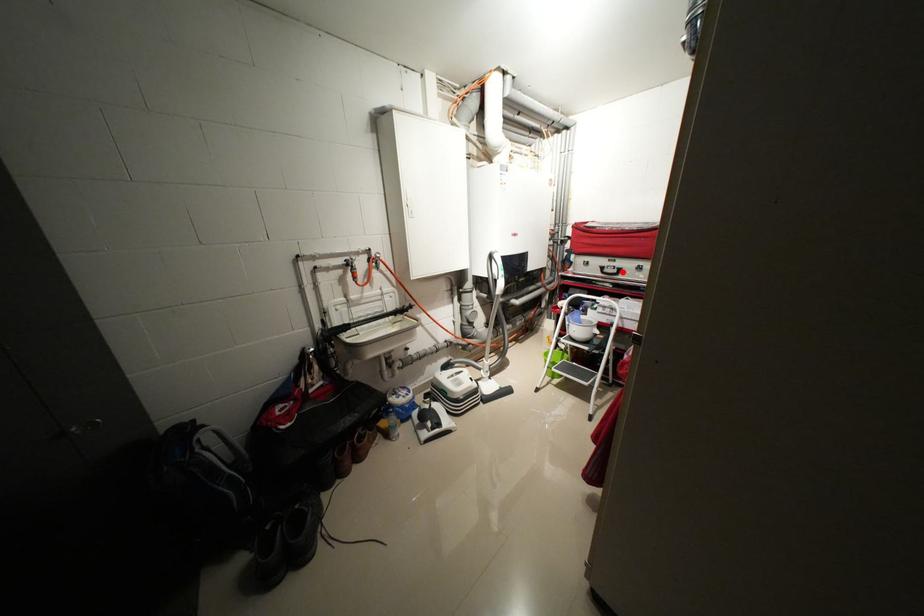
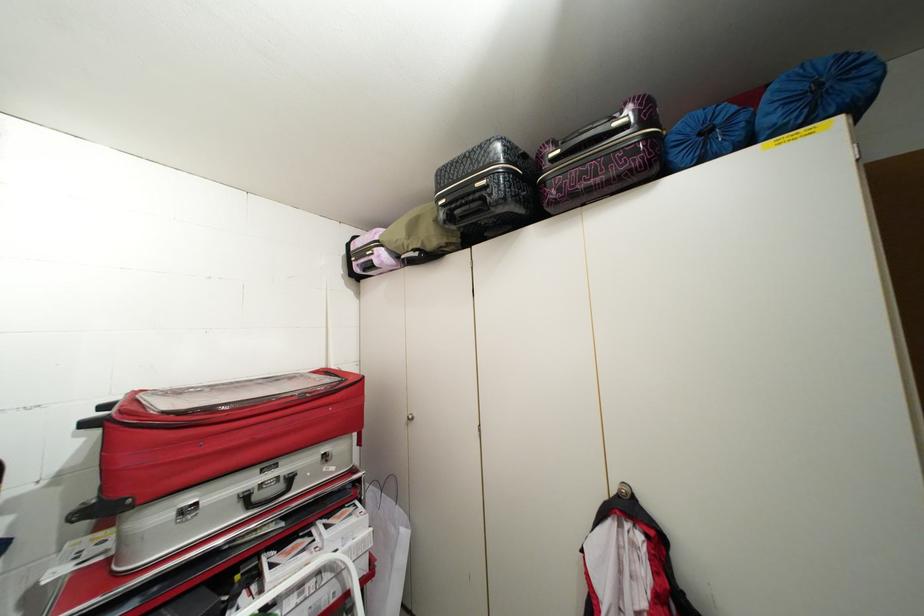
Question: I am providing you with two images of the same scene from different viewpoints. A red point is shown in image1. For the corresponding object point in image2, is it positioned nearer or farther from the camera?

Choices:
 (A) Nearer
 (B) Farther

Answer: (B)